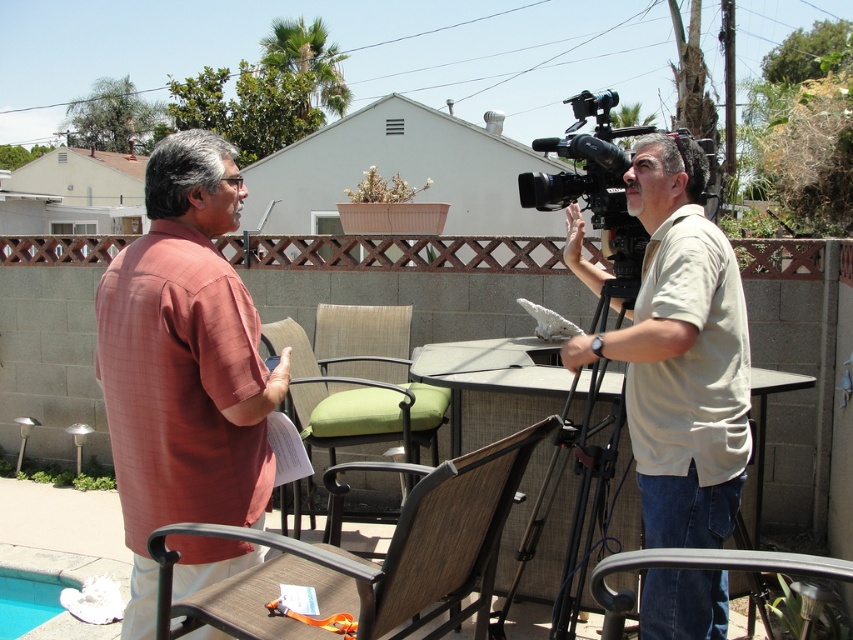
Who is lower down, black metal tripod at center or black plastic video camera at right?

black metal tripod at center is lower down.

Does black metal tripod at center appear on the left side of black plastic video camera at right?

Indeed, black metal tripod at center is positioned on the left side of black plastic video camera at right.

Who is more forward, (547,497) or (590,161)?

Point (590,161)

Locate an element on the screen. The height and width of the screenshot is (640, 853). black metal tripod at center is located at coordinates (573, 502).

Is plaid cotton shirt at center thinner than beige cotton shirt at center?

No, plaid cotton shirt at center is not thinner than beige cotton shirt at center.

Is point (210, 579) in front of point (738, 451)?

That is False.

Where is `plaid cotton shirt at center`? This screenshot has height=640, width=853. plaid cotton shirt at center is located at coordinates (183, 364).

Find the location of a particular element. plaid cotton shirt at center is located at coordinates (183, 364).

Is point (257, 568) closer to camera compared to point (566, 563)?

Yes, it is.

Consider the image. Between brown woven chair at lower center and black metal tripod at center, which one has less height?

Standing shorter between the two is brown woven chair at lower center.

Between point (367, 595) and point (566, 612), which one is positioned behind?

Point (566, 612)

Where is `brown woven chair at lower center`? brown woven chair at lower center is located at coordinates (370, 561).